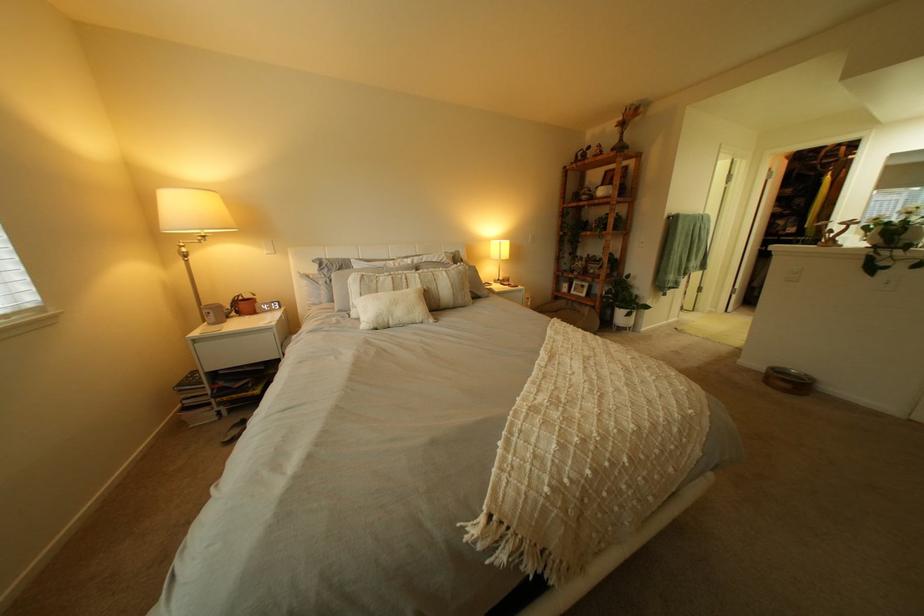
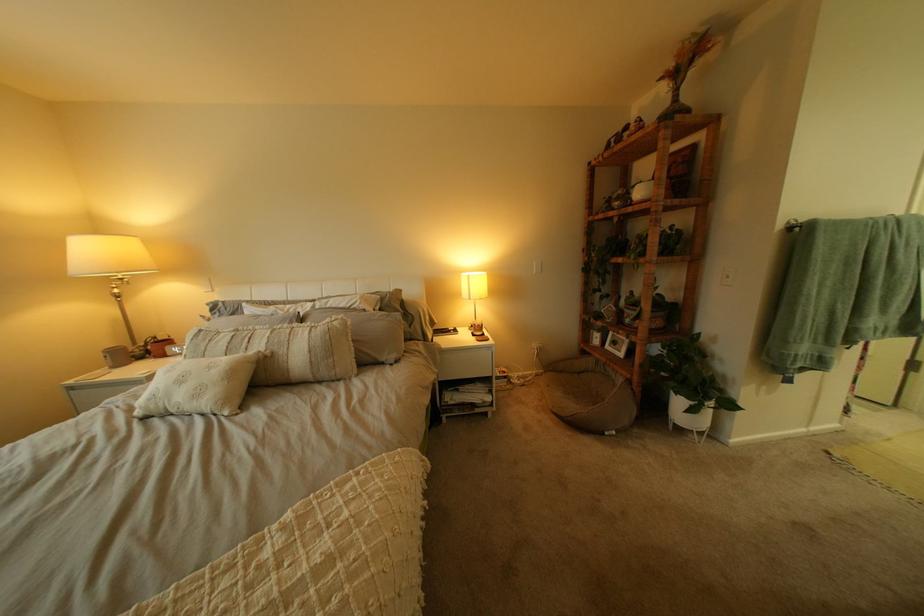
Where in the second image is the point corresponding to (516,244) from the first image?

(483, 277)